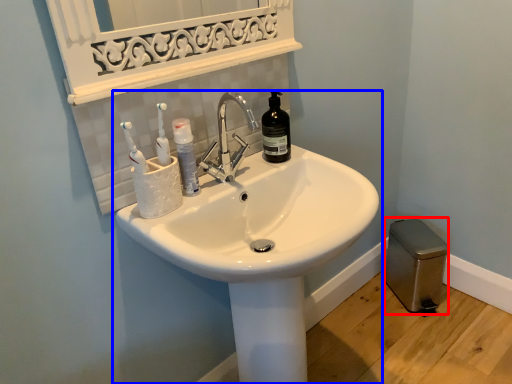
Question: Which of the following is the farthest to the observer, gray (highlighted by a red box) or sink (highlighted by a blue box)?

Choices:
 (A) gray
 (B) sink

Answer: (A)